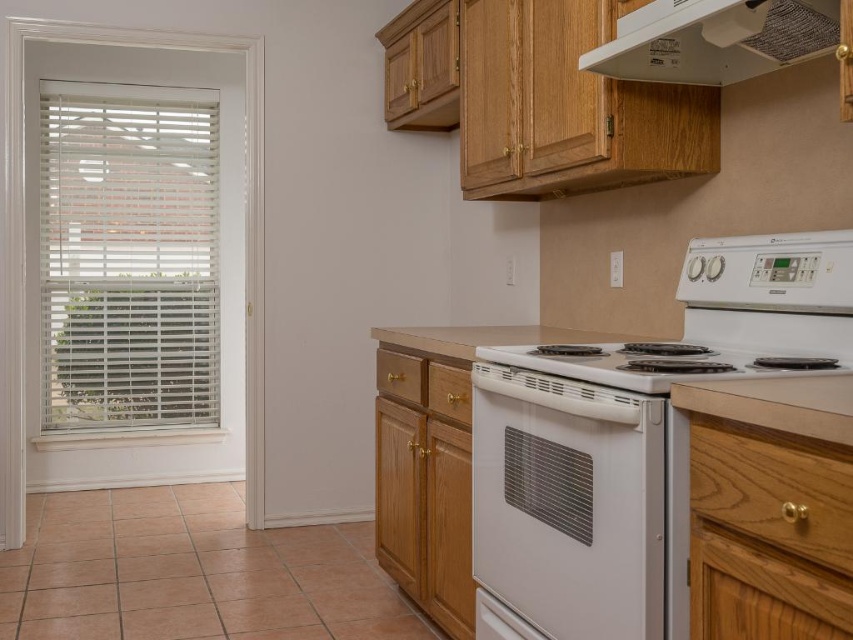
Question: Does white glossy oven at center lie in front of white textured exhaust hood at upper center?

Choices:
 (A) yes
 (B) no

Answer: (A)

Question: Which object is closer to the camera taking this photo?

Choices:
 (A) white glossy stove at center
 (B) white glossy oven at center
 (C) white textured exhaust hood at upper center

Answer: (A)

Question: In this image, where is white glossy oven at center located relative to white textured exhaust hood at upper center?

Choices:
 (A) above
 (B) below

Answer: (B)

Question: Which is farther from the white glossy oven at center?

Choices:
 (A) white textured exhaust hood at upper center
 (B) white glossy electric stove at center right
 (C) white glossy stove at center

Answer: (A)

Question: In this image, where is white glossy electric stove at center right located relative to white glossy stove at center?

Choices:
 (A) above
 (B) below

Answer: (B)

Question: Considering the real-world distances, which object is closest to the white glossy oven at center?

Choices:
 (A) white textured exhaust hood at upper center
 (B) white glossy stove at center

Answer: (B)